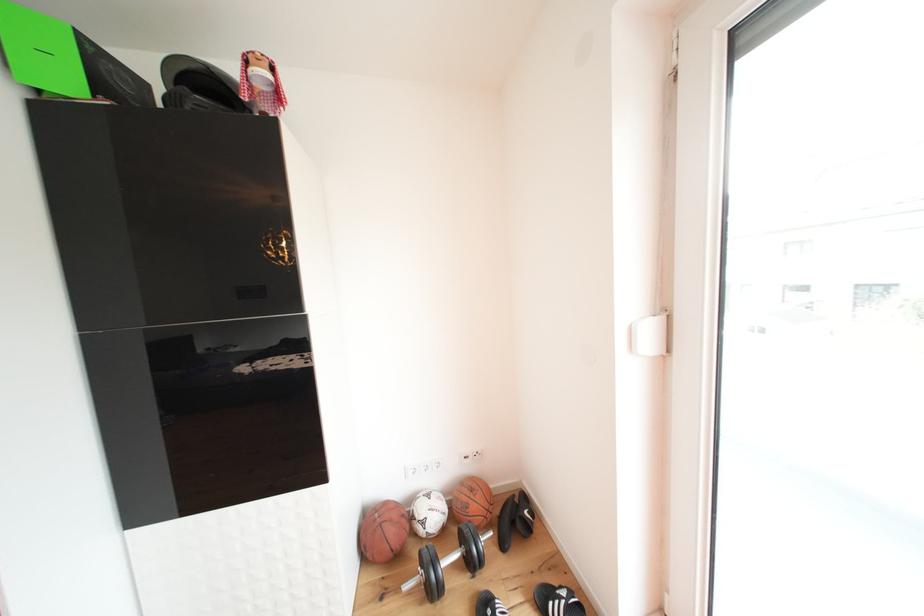
Image resolution: width=924 pixels, height=616 pixels. I want to click on metal dumbbell, so click(x=451, y=557).